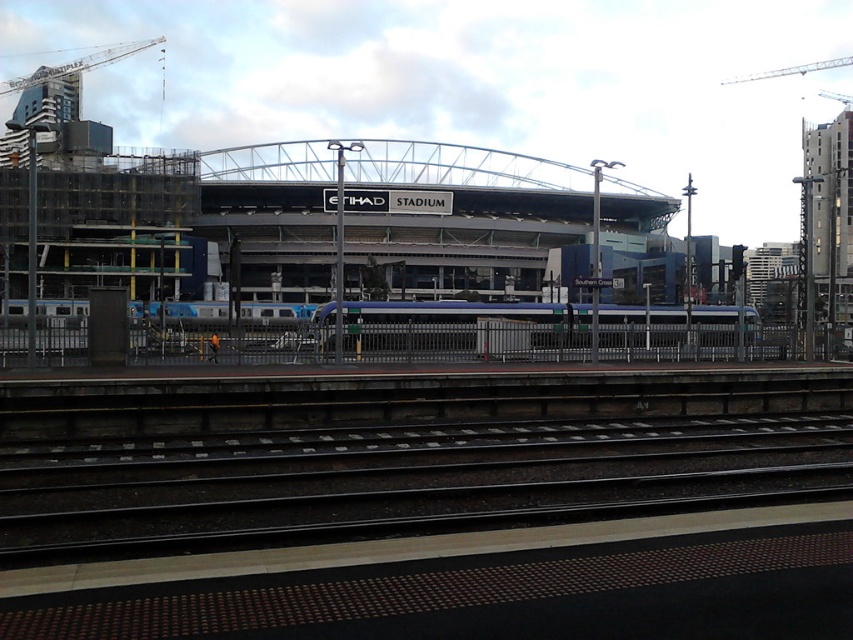
Consider the image. You are a photographer standing on the platform at the train station. You want to take a photo of the blue metallic train at center and the metallic gray crane at upper left in the same frame. Which object should you zoom in on to ensure both are visible in the photo?

Since the blue metallic train at center is smaller than the metallic gray crane at upper left, you should zoom in on the blue metallic train at center to include both in the frame.

You are standing at the platform of the train station near the Etihad Stadium. You see two points marked on the ground. One is at point coordinates point (838, 465) and the other at point (49, 70). Which point is closer to you?

Point (838, 465) is in front of point (49, 70), so it is closer to you.

You are a photographer trying to capture a wide shot of the blue metallic train at center and the metallic gray crane at upper left. Given that the camera lens you have can only focus on objects wider than 2 meters, will both objects be in focus?

The blue metallic train at center is thinner than the metallic gray crane at upper left. Since the camera lens can only focus on objects wider than 2 meters, the crane is wider and will be in focus, but the train might be too thin to meet the minimum width requirement. However, without knowing the exact widths, we can only confirm the crane qualifies.